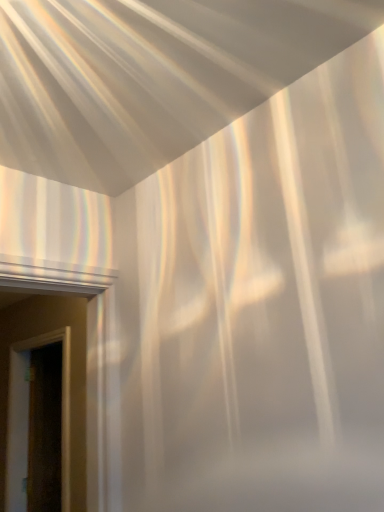
Describe the element at coordinates (45, 429) in the screenshot. The height and width of the screenshot is (512, 384). I see `transparent glass door at lower left` at that location.

In order to face transparent glass door at lower left, should I rotate leftwards or rightwards?

Turn left approximately 18.493 degrees to face it.

In order to click on transparent glass door at lower left in this screenshot , I will do `click(45, 429)`.

Find the location of `transparent glass door at lower left`. transparent glass door at lower left is located at coordinates (45, 429).